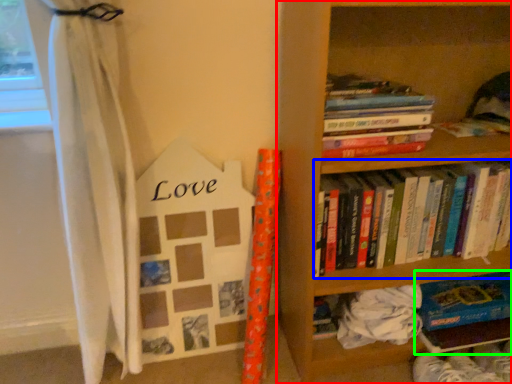
Question: Which is nearer to the bookcase (highlighted by a red box)? book (highlighted by a blue box) or book (highlighted by a green box).

Choices:
 (A) book
 (B) book

Answer: (A)